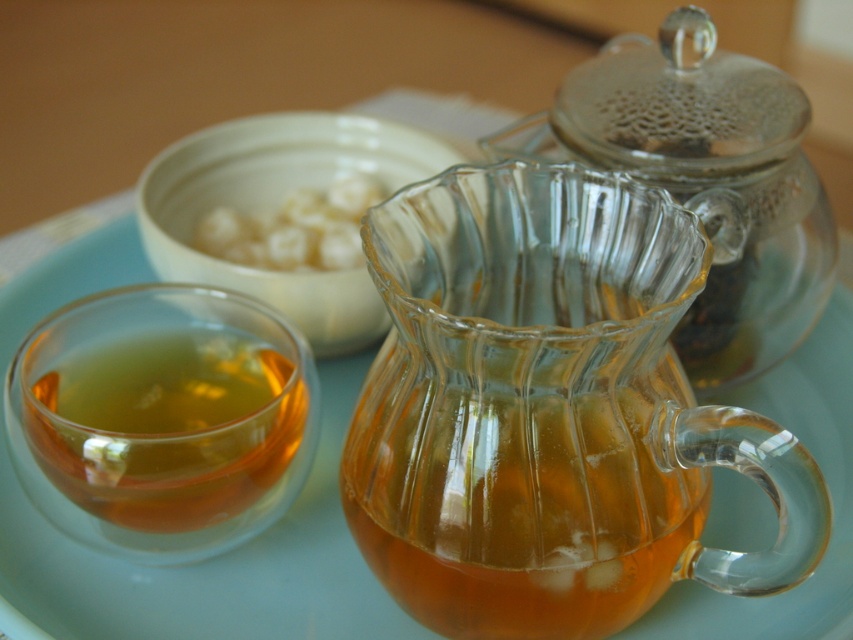
Question: Which point is closer to the camera taking this photo?

Choices:
 (A) (262, 452)
 (B) (402, 179)
 (C) (721, 172)

Answer: (A)

Question: Based on their relative distances, which object is farther from the white matte bowl at upper center?

Choices:
 (A) transparent glass teapot at center
 (B) translucent glass cup at left

Answer: (A)

Question: Estimate the real-world distances between objects in this image. Which object is farther from the transparent glass carafe at center?

Choices:
 (A) white matte bowl at upper center
 (B) translucent glass cup at left
 (C) white creamy dumplings at upper center

Answer: (C)

Question: Does white matte bowl at upper center have a smaller size compared to white creamy dumplings at upper center?

Choices:
 (A) no
 (B) yes

Answer: (A)

Question: Is transparent glass carafe at center smaller than white matte bowl at upper center?

Choices:
 (A) no
 (B) yes

Answer: (B)

Question: Can you confirm if white matte bowl at upper center is positioned below white creamy dumplings at upper center?

Choices:
 (A) no
 (B) yes

Answer: (A)